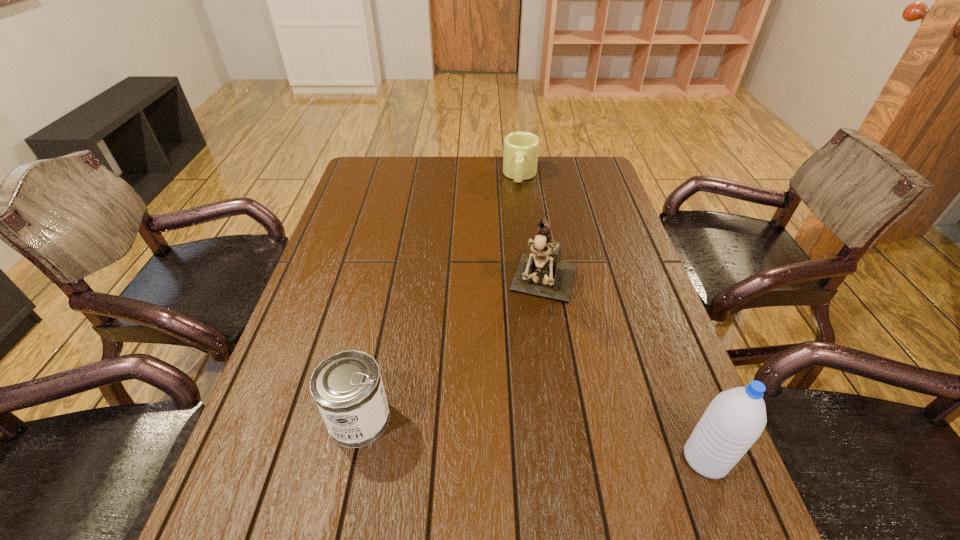
At what (x,y) coordinates should I click in order to perform the action: click on empty space that is in between the can and the rightmost object. Please return your answer as a coordinate pair (x, y). This screenshot has height=540, width=960. Looking at the image, I should click on (533, 439).

This screenshot has height=540, width=960. I want to click on unoccupied position between the water bottle and the third nearest object, so click(626, 373).

The height and width of the screenshot is (540, 960). I want to click on free spot between the farthest object and the can, so click(x=440, y=298).

In order to click on vacant point located between the second tallest object and the mug in this screenshot , I will do `click(612, 317)`.

Locate an element on the screen. The height and width of the screenshot is (540, 960). empty space between the tallest object and the mug is located at coordinates point(533,231).

This screenshot has height=540, width=960. I want to click on free point between the farthest object and the tallest object, so click(x=533, y=231).

You are a GUI agent. You are given a task and a screenshot of the screen. Output one action in this format:
    pyautogui.click(x=<x>, y=<y>)
    Task: Click on the empty space that is in between the second tallest object and the leftmost object
    The width and height of the screenshot is (960, 540).
    Given the screenshot: What is the action you would take?
    pyautogui.click(x=533, y=439)

The width and height of the screenshot is (960, 540). What are the coordinates of `vacant point located between the second farthest object and the water bottle` in the screenshot? It's located at (626, 373).

Find the location of a particular element. This screenshot has width=960, height=540. object that can be found as the second closest to the third shortest object is located at coordinates click(347, 387).

The width and height of the screenshot is (960, 540). I want to click on object that ranks as the third closest to the third shortest object, so click(521, 149).